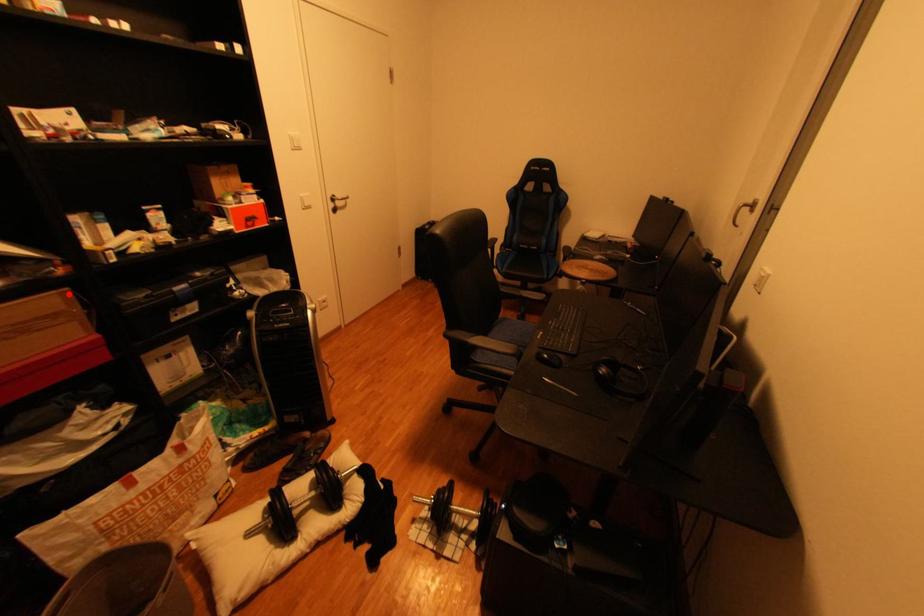
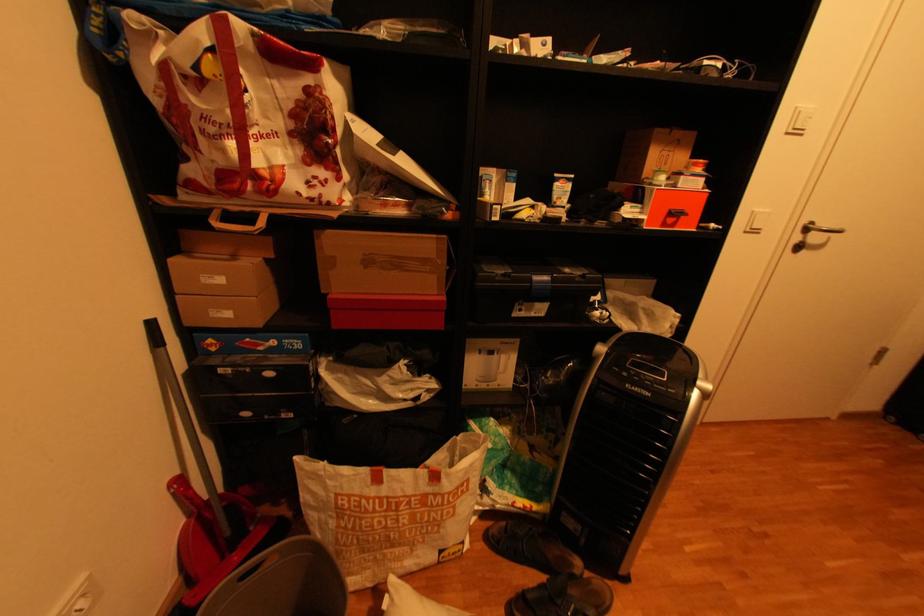
Where in the second image is the point corresponding to the highlighted location from the first image?

(446, 238)